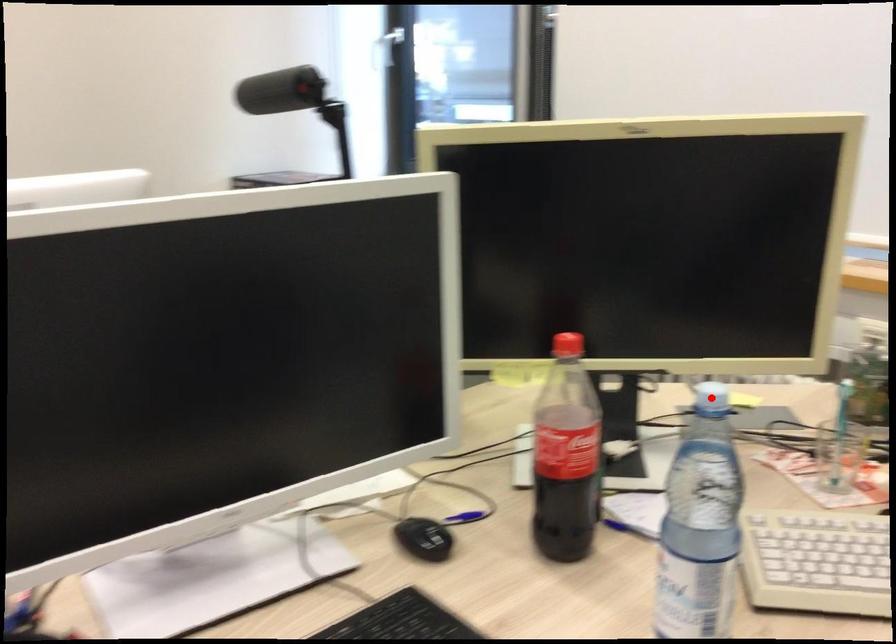
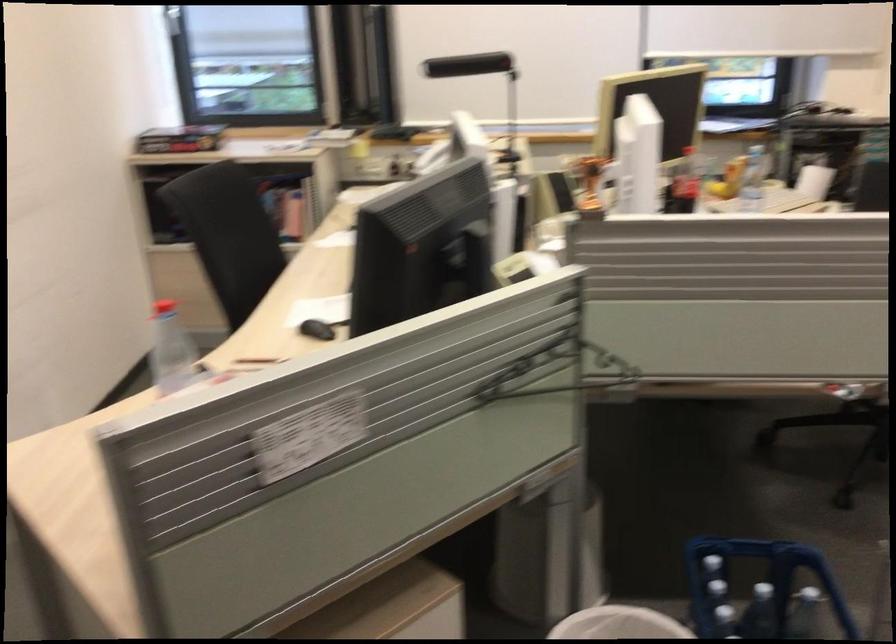
Question: I am providing you with two images of the same scene from different viewpoints. Image1 has a red point marked. In image2, the corresponding 3D location appears at what relative position? Reply with the corresponding letter.

Choices:
 (A) Closer
 (B) Farther

Answer: (B)